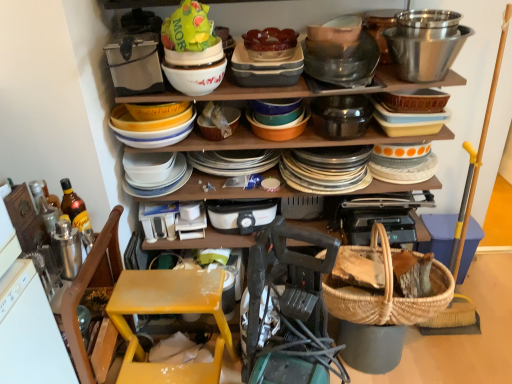
Locate an element on the screen. empty space that is ontop of yellow plastic step stool at lower left (from a real-world perspective) is located at coordinates (170, 294).